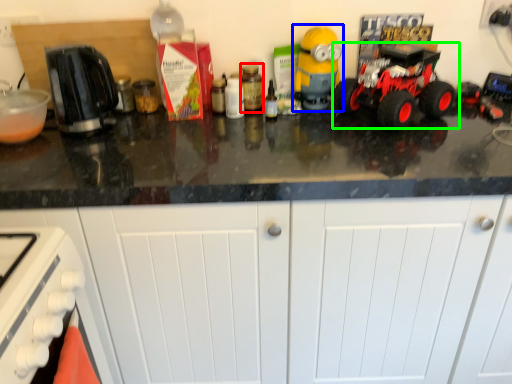
Question: Considering the real-world distances, which object is farthest from bottle (highlighted by a red box)? toy (highlighted by a blue box) or land vehicle (highlighted by a green box)?

Choices:
 (A) toy
 (B) land vehicle

Answer: (B)